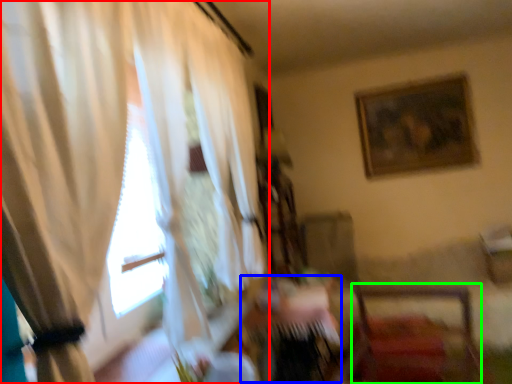
Question: Which is nearer to the curtain (highlighted by a red box)? table (highlighted by a blue box) or chair (highlighted by a green box).

Choices:
 (A) table
 (B) chair

Answer: (A)